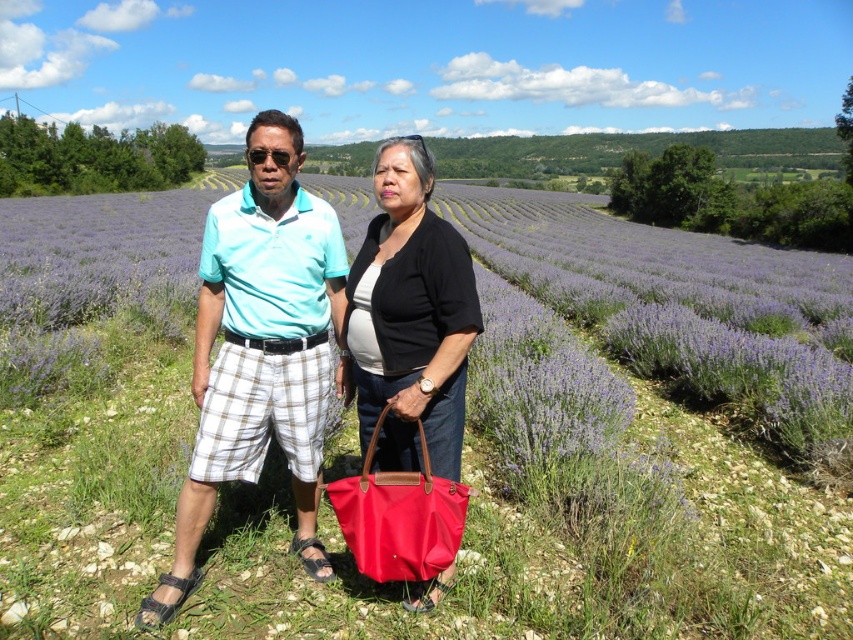
Who is more forward, [129,237] or [344,371]?

Point [344,371]

The height and width of the screenshot is (640, 853). I want to click on purple lavender field at center, so click(561, 516).

At what (x,y) coordinates should I click in order to perform the action: click on purple lavender field at center. Please return your answer as a coordinate pair (x, y). Image resolution: width=853 pixels, height=640 pixels. Looking at the image, I should click on (561, 516).

Looking at this image, how much distance is there between purple lavender field at center and light blue cotton polo shirt at center?

purple lavender field at center and light blue cotton polo shirt at center are 35.01 meters apart from each other.

Is point (47, 316) more distant than point (264, 435)?

That is True.

What do you see at coordinates (561, 516) in the screenshot? This screenshot has height=640, width=853. I see `purple lavender field at center` at bounding box center [561, 516].

Identify the location of purple lavender field at center. (561, 516).

Who is positioned more to the right, light blue cotton polo shirt at center or red nylon tote at center?

red nylon tote at center is more to the right.

Which is in front, point (299, 436) or point (364, 493)?

Positioned in front is point (364, 493).

Is point (222, 211) closer to viewer compared to point (395, 470)?

Yes, point (222, 211) is closer to viewer.

This screenshot has height=640, width=853. Identify the location of light blue cotton polo shirt at center. (260, 349).